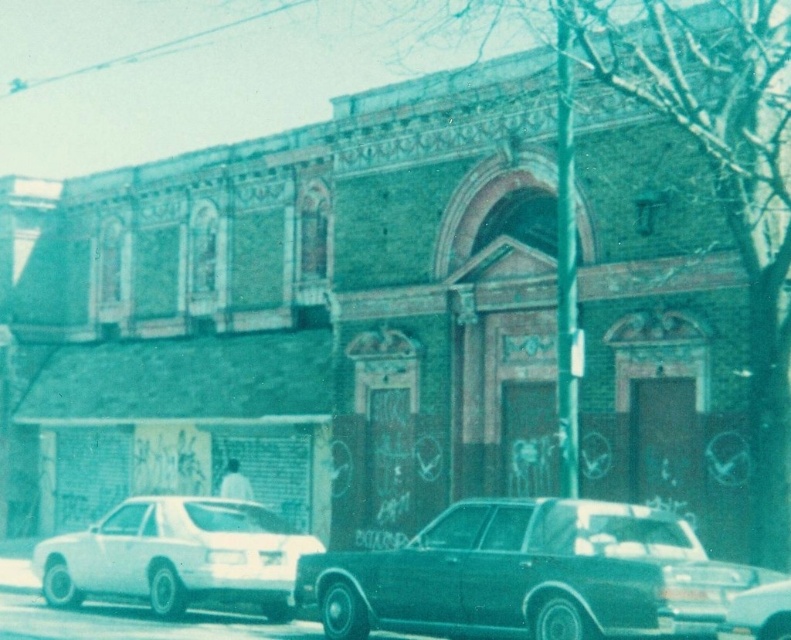
Question: Estimate the real-world distances between objects in this image. Which object is closer to the white glossy sedan at lower left?

Choices:
 (A) shiny black sedan at center
 (B) metallic silver sedan at center

Answer: (A)

Question: Does white glossy sedan at lower left appear under metallic silver sedan at center?

Choices:
 (A) no
 (B) yes

Answer: (B)

Question: Which object is farther from the camera taking this photo?

Choices:
 (A) metallic silver sedan at center
 (B) white glossy sedan at lower left

Answer: (B)

Question: Can you confirm if shiny black sedan at center is positioned above white glossy sedan at lower left?

Choices:
 (A) yes
 (B) no

Answer: (A)

Question: Can you confirm if shiny black sedan at center is smaller than metallic silver sedan at center?

Choices:
 (A) yes
 (B) no

Answer: (A)

Question: Based on their relative distances, which object is farther from the metallic silver sedan at center?

Choices:
 (A) shiny black sedan at center
 (B) white glossy sedan at lower left

Answer: (B)